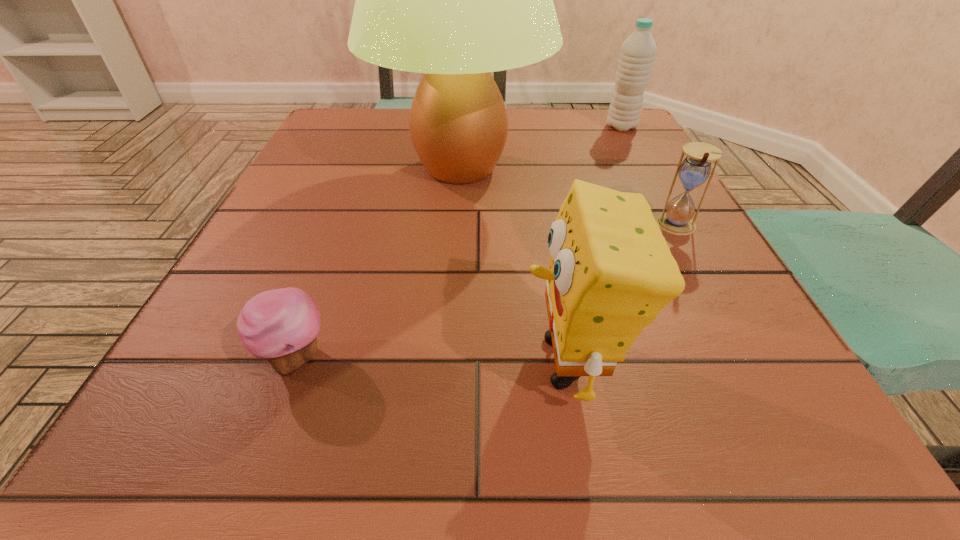
Locate an element on the screen. This screenshot has height=540, width=960. vacant space that satisfies the following two spatial constraints: 1. on the front side of the second shortest object; 2. on the right side of the water bottle is located at coordinates (675, 226).